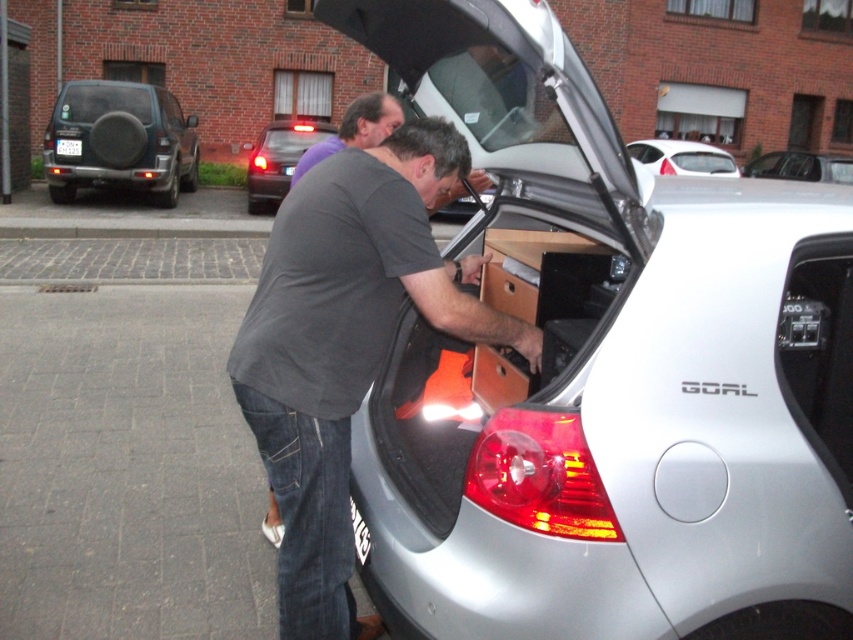
Question: Does matte black suv at left lie in front of white glossy car at upper center?

Choices:
 (A) no
 (B) yes

Answer: (B)

Question: Which of these objects is positioned farthest from the matte black car at upper center?

Choices:
 (A) dark gray t-shirt at center
 (B) matte black suv at left
 (C) metallic silver car at center
 (D) silver metallic car at center

Answer: (D)

Question: Which point is closer to the camera taking this photo?

Choices:
 (A) tap(343, 404)
 (B) tap(755, 163)
 (C) tap(254, 144)
 (D) tap(115, 168)

Answer: (A)

Question: Estimate the real-world distances between objects in this image. Which object is closer to the metallic silver car at center?

Choices:
 (A) dark gray t-shirt at center
 (B) matte black car at upper center
 (C) white glossy car at upper center

Answer: (C)

Question: Observing the image, what is the correct spatial positioning of matte black suv at left in reference to white glossy car at upper center?

Choices:
 (A) right
 (B) left

Answer: (B)

Question: Does silver metallic car at center have a lesser width compared to metallic silver car at center?

Choices:
 (A) no
 (B) yes

Answer: (A)